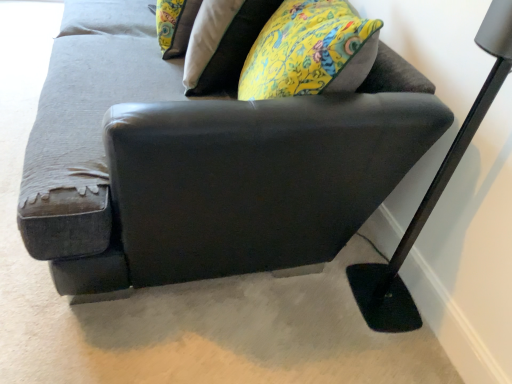
This screenshot has height=384, width=512. What do you see at coordinates (432, 192) in the screenshot?
I see `black metal floor lamp at lower right` at bounding box center [432, 192].

This screenshot has width=512, height=384. I want to click on dark gray fabric couch at center, so click(x=202, y=163).

Which point is more forward, (450,173) or (170,29)?

Positioned in front is point (450,173).

How different are the orientations of black metal floor lamp at lower right and floral fabric pillow at upper center in degrees?

black metal floor lamp at lower right and floral fabric pillow at upper center are facing 12.4 degrees away from each other.

Does black metal floor lamp at lower right have a lesser height compared to floral fabric pillow at upper center?

No.

From the picture: Which object is thinner, black metal floor lamp at lower right or floral fabric pillow at upper center?

Thinner between the two is black metal floor lamp at lower right.

What are the coordinates of `studio couch in front of the floral fabric pillow at upper center` in the screenshot? It's located at (202, 163).

Is floral fabric pillow at upper center to the right of dark gray fabric couch at center from the viewer's perspective?

Indeed, floral fabric pillow at upper center is positioned on the right side of dark gray fabric couch at center.

From the picture: From the image's perspective, is floral fabric pillow at upper center positioned above or below dark gray fabric couch at center?

Based on their image positions, floral fabric pillow at upper center is located above dark gray fabric couch at center.

How different are the orientations of floral fabric pillow at upper center and black metal floor lamp at lower right in degrees?

The angle between the facing direction of floral fabric pillow at upper center and the facing direction of black metal floor lamp at lower right is 12.4 degrees.

Does floral fabric pillow at upper center touch black metal floor lamp at lower right?

No.

Considering the sizes of objects floral fabric pillow at upper center and black metal floor lamp at lower right in the image provided, who is thinner, floral fabric pillow at upper center or black metal floor lamp at lower right?

black metal floor lamp at lower right is thinner.

I want to click on pillow that appears above the black metal floor lamp at lower right (from a real-world perspective), so click(x=175, y=25).

Locate an element on the screen. The width and height of the screenshot is (512, 384). studio couch in front of the black metal floor lamp at lower right is located at coordinates (202, 163).

Looking at this image, between black metal floor lamp at lower right and dark gray fabric couch at center, which one has more height?

black metal floor lamp at lower right is taller.

Is point (414, 233) less distant than point (100, 186)?

No, it is not.

From a real-world perspective, is black metal floor lamp at lower right under dark gray fabric couch at center?

Actually, black metal floor lamp at lower right is physically above dark gray fabric couch at center in the real world.

Measure the distance from dark gray fabric couch at center to black metal floor lamp at lower right.

The distance of dark gray fabric couch at center from black metal floor lamp at lower right is 21.99 inches.

Is dark gray fabric couch at center facing away from black metal floor lamp at lower right?

Yes, dark gray fabric couch at center is positioned with its back facing black metal floor lamp at lower right.

Image resolution: width=512 pixels, height=384 pixels. Find the location of `studio couch in front of the black metal floor lamp at lower right`. studio couch in front of the black metal floor lamp at lower right is located at coordinates (202, 163).

From a real-world perspective, which is physically below, dark gray fabric couch at center or black metal floor lamp at lower right?

From a 3D spatial view, dark gray fabric couch at center is below.

Considering the sizes of dark gray fabric couch at center and floral fabric pillow at upper center in the image, is dark gray fabric couch at center taller or shorter than floral fabric pillow at upper center?

Considering their sizes, dark gray fabric couch at center has more height than floral fabric pillow at upper center.

Would you consider dark gray fabric couch at center to be distant from floral fabric pillow at upper center?

No, dark gray fabric couch at center is not far from floral fabric pillow at upper center.

How much distance is there between dark gray fabric couch at center and floral fabric pillow at upper center?

dark gray fabric couch at center and floral fabric pillow at upper center are 22.34 inches apart from each other.

Which of these two, dark gray fabric couch at center or floral fabric pillow at upper center, is bigger?

dark gray fabric couch at center.

This screenshot has height=384, width=512. I want to click on table lamp below the floral fabric pillow at upper center (from a real-world perspective), so click(432, 192).

Identify the location of pillow on the right of the dark gray fabric couch at center. This screenshot has height=384, width=512. (175, 25).

Consider the image. Estimate the real-world distances between objects in this image. Which object is closer to black metal floor lamp at lower right, floral fabric pillow at upper center or dark gray fabric couch at center?

dark gray fabric couch at center is positioned closer to the anchor black metal floor lamp at lower right.

Looking at this image, estimate the real-world distances between objects in this image. Which object is closer to floral fabric pillow at upper center, black metal floor lamp at lower right or dark gray fabric couch at center?

The object closer to floral fabric pillow at upper center is dark gray fabric couch at center.

From the image, which object appears to be farther from dark gray fabric couch at center, black metal floor lamp at lower right or floral fabric pillow at upper center?

floral fabric pillow at upper center is positioned further to the anchor dark gray fabric couch at center.

When comparing their distances from black metal floor lamp at lower right, does dark gray fabric couch at center or floral fabric pillow at upper center seem further?

Based on the image, floral fabric pillow at upper center appears to be further to black metal floor lamp at lower right.

Looking at the image, which one is located closer to dark gray fabric couch at center, floral fabric pillow at upper center or black metal floor lamp at lower right?

black metal floor lamp at lower right is positioned closer to the anchor dark gray fabric couch at center.

Based on their spatial positions, is dark gray fabric couch at center or black metal floor lamp at lower right further from floral fabric pillow at upper center?

Among the two, black metal floor lamp at lower right is located further to floral fabric pillow at upper center.

You are a GUI agent. You are given a task and a screenshot of the screen. Output one action in this format:
    pyautogui.click(x=<x>, y=<y>)
    Task: Click on the pillow located between dark gray fabric couch at center and black metal floor lamp at lower right in the left-right direction
    This screenshot has height=384, width=512.
    Given the screenshot: What is the action you would take?
    175,25